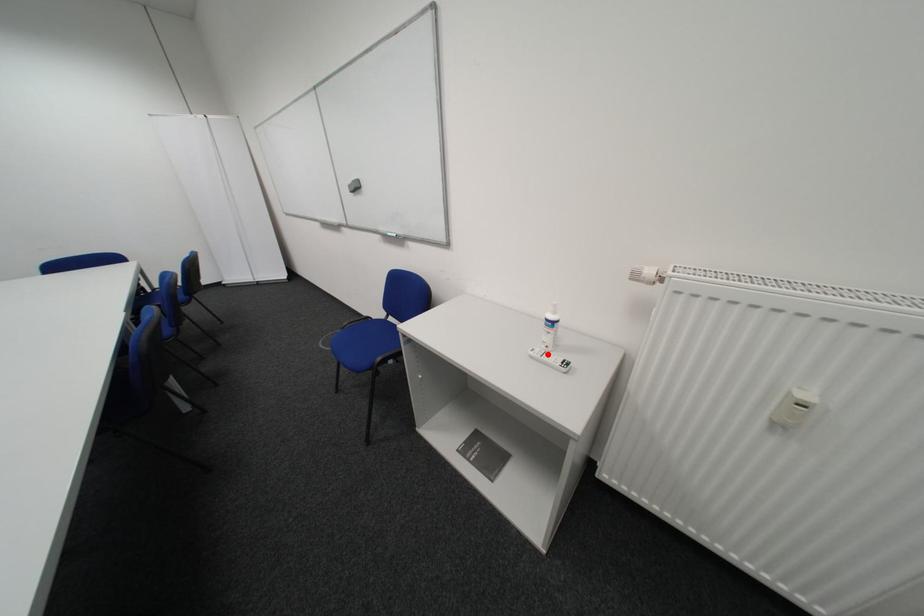
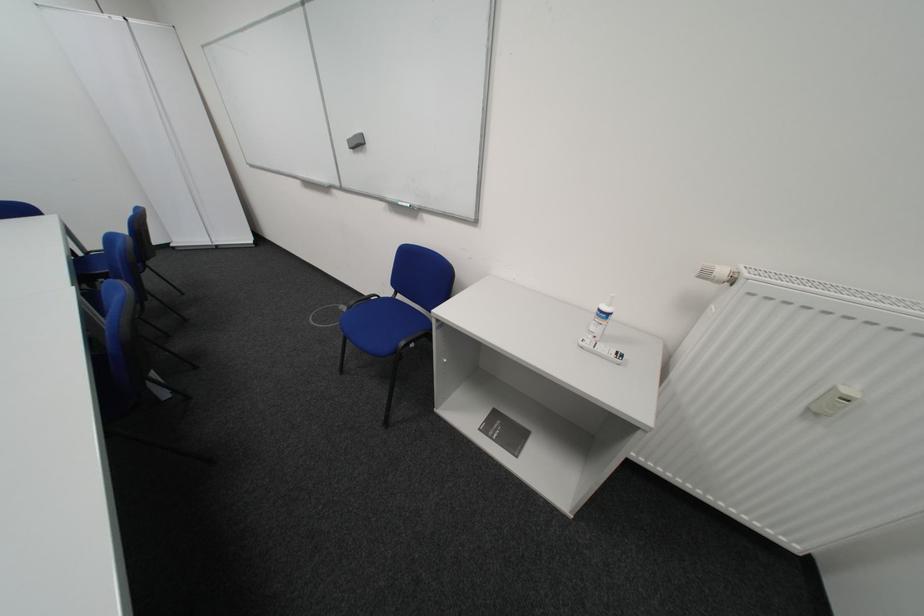
The point at the highlighted location is marked in the first image. Where is the corresponding point in the second image?

(599, 345)